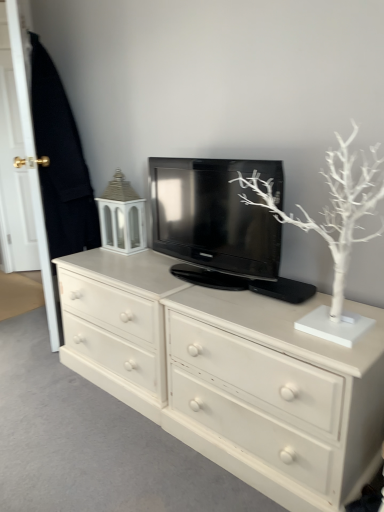
Question: Is black glossy television at center bigger or smaller than white matte tree at upper right?

Choices:
 (A) big
 (B) small

Answer: (B)

Question: From the image's perspective, is black glossy television at center positioned above or below white matte tree at upper right?

Choices:
 (A) above
 (B) below

Answer: (A)

Question: Which of these objects is positioned farthest from the black glossy television at center?

Choices:
 (A) white painted wood chest of drawers at center
 (B) white matte tree at upper right
 (C) white wood door at left

Answer: (C)

Question: Which object is positioned closest to the white wood door at left?

Choices:
 (A) black glossy television at center
 (B) white painted wood chest of drawers at center
 (C) white matte tree at upper right

Answer: (A)